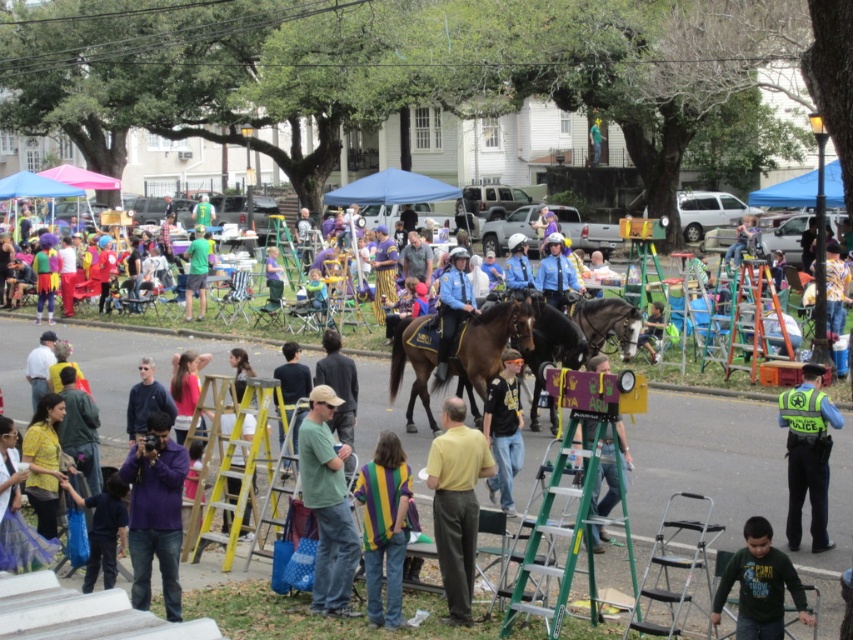
Which of these two, shiny brown horse at center or green fabric shirt at center, stands taller?

With more height is shiny brown horse at center.

Between shiny brown horse at center and green fabric shirt at center, which one is positioned lower?

shiny brown horse at center is lower down.

Is point (627, 328) more distant than point (189, 301)?

No, (627, 328) is in front of (189, 301).

Where is `shiny brown horse at center`? shiny brown horse at center is located at coordinates (573, 336).

Is green fabric sign at center to the right of green fabric shirt at center from the viewer's perspective?

Yes, green fabric sign at center is to the right of green fabric shirt at center.

Does green fabric sign at center have a greater width compared to green fabric shirt at center?

Indeed, green fabric sign at center has a greater width compared to green fabric shirt at center.

I want to click on green fabric sign at center, so click(x=606, y=476).

The height and width of the screenshot is (640, 853). I want to click on green fabric sign at center, so click(606, 476).

Who is taller, purple cotton shirt at lower left or shiny brown horse at center?

Standing taller between the two is shiny brown horse at center.

Between purple cotton shirt at lower left and shiny brown horse at center, which one is positioned lower?

Positioned lower is purple cotton shirt at lower left.

Identify the location of purple cotton shirt at lower left. (155, 513).

Find the location of a particular element. The width and height of the screenshot is (853, 640). purple cotton shirt at lower left is located at coordinates (155, 513).